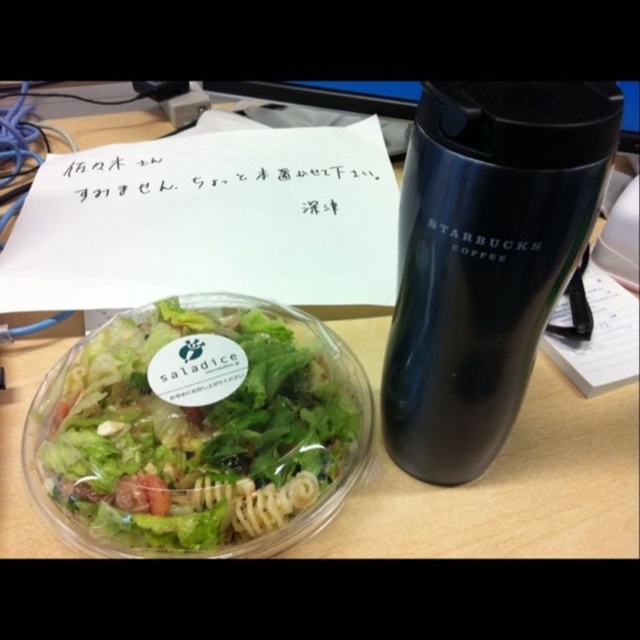
Question: Based on their relative distances, which object is nearer to the black matte thermos at right?

Choices:
 (A) translucent plastic salad bowl at lower left
 (B) black paper at upper center
 (C) spiral pasta at center
 (D) wooden table at center

Answer: (D)

Question: Is the position of black paper at upper center more distant than that of spiral pasta at center?

Choices:
 (A) no
 (B) yes

Answer: (B)

Question: Which object is farther from the camera taking this photo?

Choices:
 (A) translucent plastic salad bowl at lower left
 (B) wooden table at center
 (C) black matte starbucks coffee cup at right
 (D) black paper at upper center

Answer: (D)

Question: Can you confirm if wooden table at center is positioned above black matte starbucks coffee cup at right?

Choices:
 (A) yes
 (B) no

Answer: (B)

Question: Can you confirm if black matte thermos at right is smaller than black paper at upper center?

Choices:
 (A) yes
 (B) no

Answer: (B)

Question: Based on their relative distances, which object is nearer to the wooden table at center?

Choices:
 (A) black matte starbucks coffee cup at right
 (B) black paper at upper center
 (C) spiral pasta at center

Answer: (C)